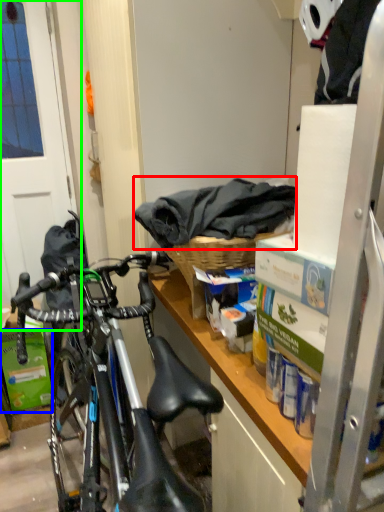
Question: Considering the real-world distances, which object is farthest from material (highlighted by a red box)? box (highlighted by a blue box) or screen door (highlighted by a green box)?

Choices:
 (A) box
 (B) screen door

Answer: (A)